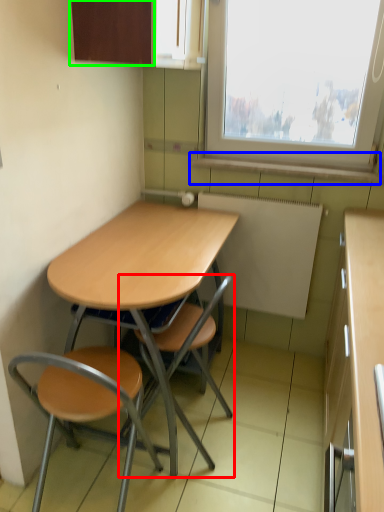
Question: Considering the real-world distances, which object is closest to chair (highlighted by a red box)? window sill (highlighted by a blue box) or cabinetry (highlighted by a green box).

Choices:
 (A) window sill
 (B) cabinetry

Answer: (A)